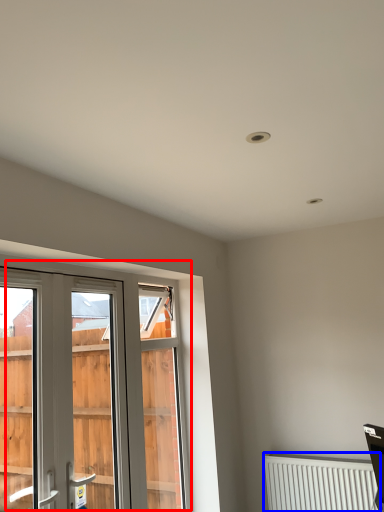
Question: Which point is closer to the camera, window (highlighted by a red box) or radiator (highlighted by a blue box)?

Choices:
 (A) window
 (B) radiator

Answer: (A)